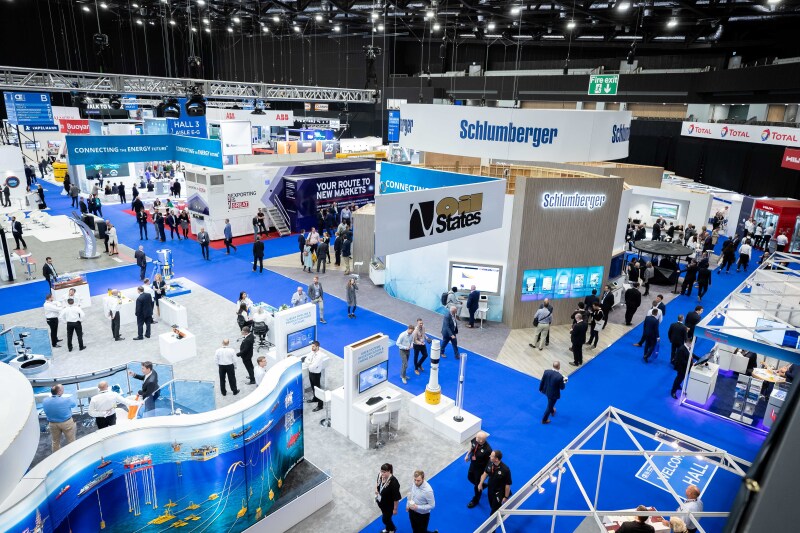
Find the location of a particular element. fire exit sign is located at coordinates (602, 82).